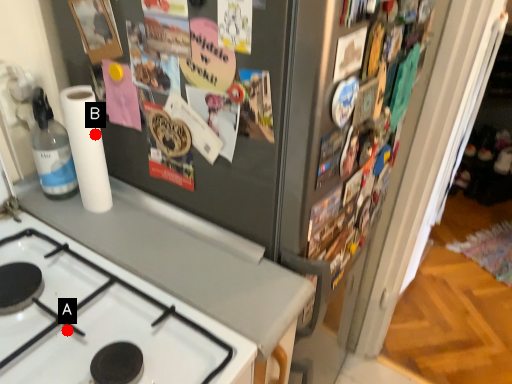
Question: Two points are circled on the image, labeled by A and B beside each circle. Which point appears closest to the camera in this image?

Choices:
 (A) A is closer
 (B) B is closer

Answer: (A)